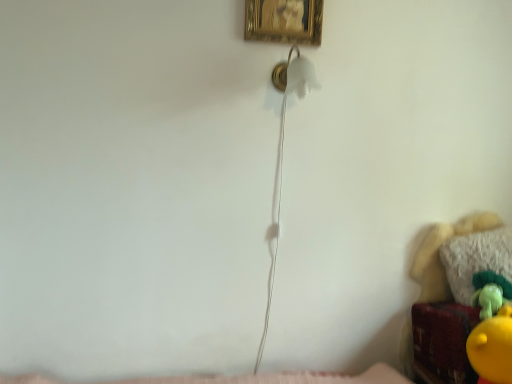
Question: Would you say white fluffy pillow at lower right is outside velvet plush toy at lower right?

Choices:
 (A) yes
 (B) no

Answer: (A)

Question: Considering the relative positions of white fluffy pillow at lower right and velvet plush toy at lower right in the image provided, is white fluffy pillow at lower right to the right of velvet plush toy at lower right from the viewer's perspective?

Choices:
 (A) no
 (B) yes

Answer: (B)

Question: Can you confirm if white fluffy pillow at lower right is wider than velvet plush toy at lower right?

Choices:
 (A) yes
 (B) no

Answer: (B)

Question: Considering the relative sizes of white fluffy pillow at lower right and velvet plush toy at lower right in the image provided, is white fluffy pillow at lower right smaller than velvet plush toy at lower right?

Choices:
 (A) yes
 (B) no

Answer: (A)

Question: Is velvet plush toy at lower right surrounded by white fluffy pillow at lower right?

Choices:
 (A) yes
 (B) no

Answer: (B)

Question: From a real-world perspective, is white fluffy pillow at lower right over velvet plush toy at lower right?

Choices:
 (A) yes
 (B) no

Answer: (A)

Question: Can you confirm if gold textured picture frame at upper center is positioned to the right of white fluffy pillow at lower right?

Choices:
 (A) no
 (B) yes

Answer: (A)

Question: Does gold textured picture frame at upper center touch white fluffy pillow at lower right?

Choices:
 (A) no
 (B) yes

Answer: (A)

Question: Is gold textured picture frame at upper center smaller than white fluffy pillow at lower right?

Choices:
 (A) yes
 (B) no

Answer: (A)

Question: Considering the relative sizes of gold textured picture frame at upper center and white fluffy pillow at lower right in the image provided, is gold textured picture frame at upper center shorter than white fluffy pillow at lower right?

Choices:
 (A) no
 (B) yes

Answer: (A)

Question: From the image's perspective, would you say gold textured picture frame at upper center is positioned over white fluffy pillow at lower right?

Choices:
 (A) yes
 (B) no

Answer: (A)

Question: Is gold textured picture frame at upper center turned away from white fluffy pillow at lower right?

Choices:
 (A) no
 (B) yes

Answer: (A)

Question: Is gold textured picture frame at upper center looking in the opposite direction of velvet plush toy at lower right?

Choices:
 (A) no
 (B) yes

Answer: (A)